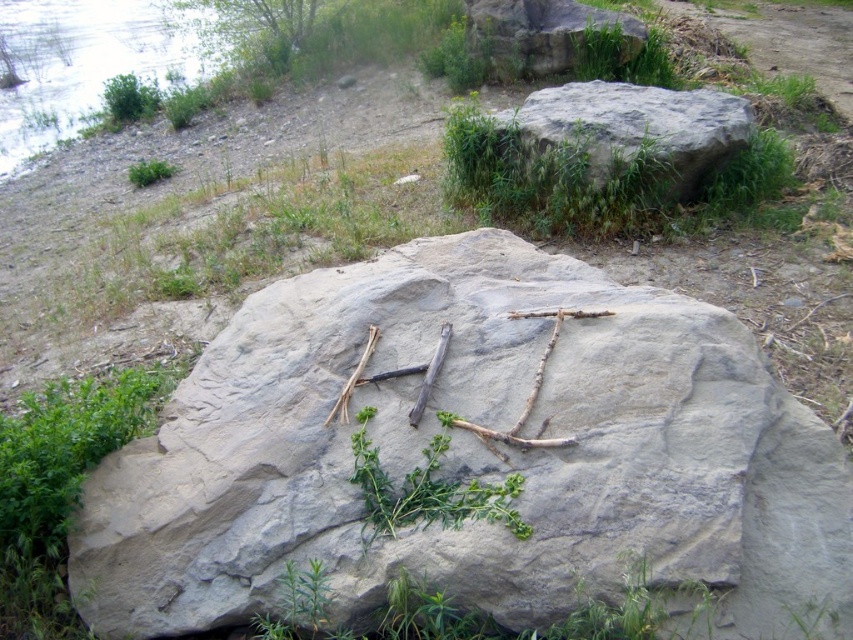
Who is lower down, gray rock at center or green leafy plant at center?

green leafy plant at center is lower down.

The width and height of the screenshot is (853, 640). Describe the element at coordinates (474, 456) in the screenshot. I see `gray rock at center` at that location.

Find the location of `gray rock at center`. gray rock at center is located at coordinates (474, 456).

Is the position of gray rock at center more distant than that of green leafy tree at upper left?

No, gray rock at center is in front of green leafy tree at upper left.

This screenshot has height=640, width=853. Describe the element at coordinates (474, 456) in the screenshot. I see `gray rock at center` at that location.

Does point (138, 588) lie behind point (292, 3)?

No, it is not.

Locate an element on the screen. gray rock at center is located at coordinates (474, 456).

Does gray rock at center appear on the right side of gray rough rock at upper center?

No, gray rock at center is not to the right of gray rough rock at upper center.

Between gray rock at center and gray rough rock at upper center, which one is positioned lower?

gray rock at center is lower down.

Image resolution: width=853 pixels, height=640 pixels. Describe the element at coordinates (474, 456) in the screenshot. I see `gray rock at center` at that location.

Image resolution: width=853 pixels, height=640 pixels. What are the coordinates of `gray rock at center` in the screenshot? It's located at (474, 456).